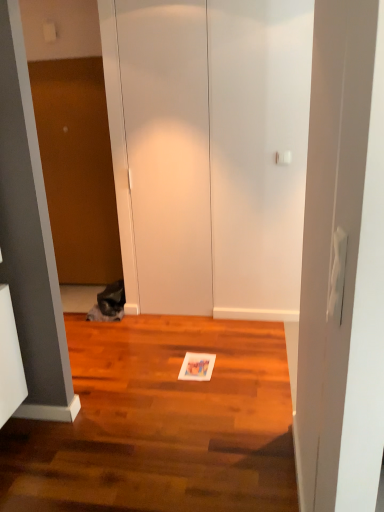
Question: In terms of width, does fuzzy gray cat at left look wider or thinner when compared to white matte door at center?

Choices:
 (A) thin
 (B) wide

Answer: (B)

Question: From a real-world perspective, is fuzzy gray cat at left above or below white matte door at center?

Choices:
 (A) above
 (B) below

Answer: (B)

Question: Which of these objects is positioned farthest from the shiny brown hardwood floor at center?

Choices:
 (A) brown matte door at left
 (B) white matte door at center
 (C) fuzzy gray cat at left

Answer: (A)

Question: Considering the real-world distances, which object is closest to the brown matte door at left?

Choices:
 (A) shiny brown hardwood floor at center
 (B) fuzzy gray cat at left
 (C) white matte door at center

Answer: (C)